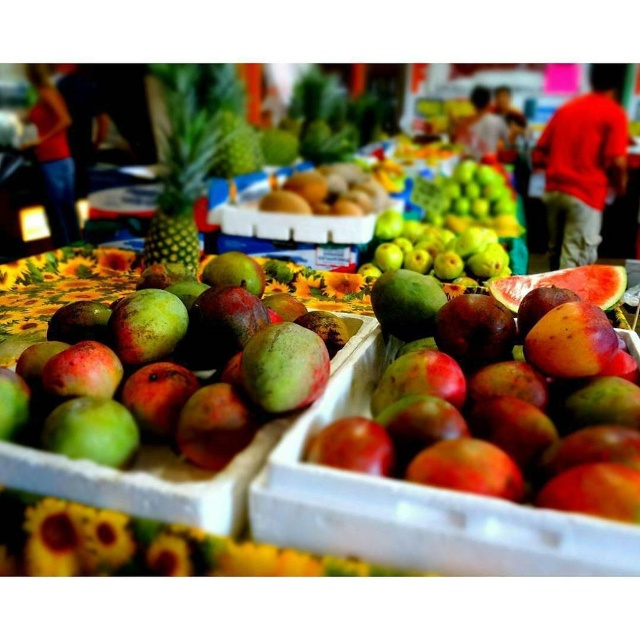
Between ripe mango at center and green matte mango at center, which one has more height?

With more height is green matte mango at center.

Is point (561, 296) in front of point (246, 433)?

No, (561, 296) is behind (246, 433).

What are the coordinates of `ripe mango at center` in the screenshot? It's located at (506, 410).